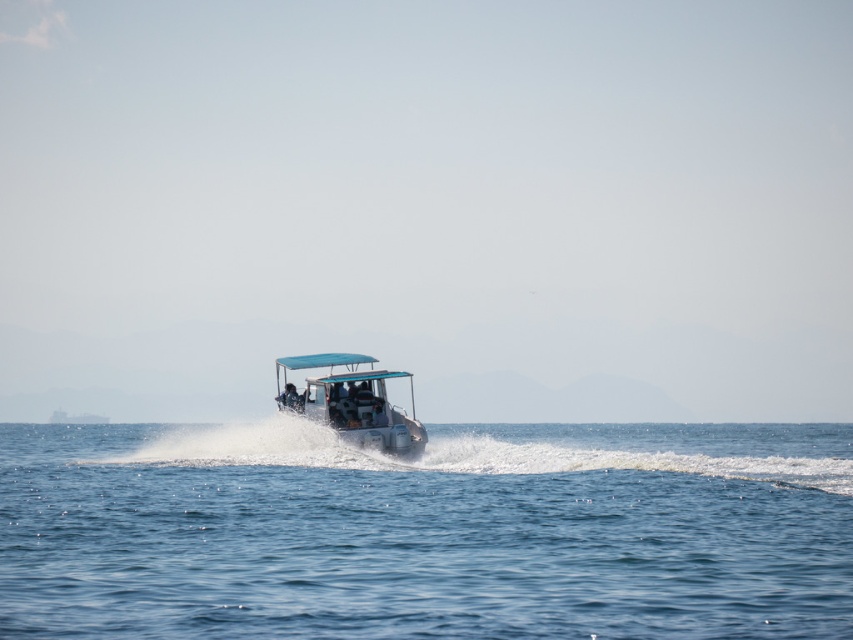
Does blue water at center lie in front of white plastic boat at center?

Yes.

Can you confirm if blue water at center is wider than white plastic boat at center?

Yes, blue water at center is wider than white plastic boat at center.

Based on the photo, who is more forward, (305,586) or (334,420)?

Point (305,586) is in front.

The width and height of the screenshot is (853, 640). I want to click on blue water at center, so click(426, 531).